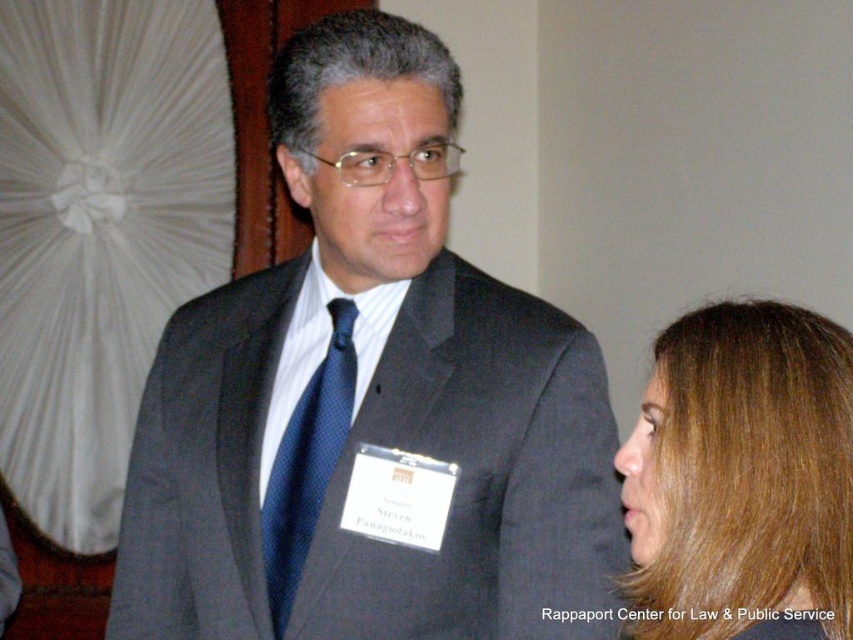
Question: Which point is farther from the camera taking this photo?

Choices:
 (A) (370, 598)
 (B) (802, 413)
 (C) (305, 540)

Answer: (C)

Question: Which object is the farthest from the brown hair at right?

Choices:
 (A) matte black suit at center
 (B) blue dotted tie at center

Answer: (B)

Question: In this image, where is matte black suit at center located relative to blue dotted tie at center?

Choices:
 (A) left
 (B) right

Answer: (B)

Question: Is brown hair at right below blue dotted tie at center?

Choices:
 (A) no
 (B) yes

Answer: (B)

Question: Which object is positioned closest to the brown hair at right?

Choices:
 (A) blue dotted tie at center
 (B) matte black suit at center

Answer: (B)

Question: Can you confirm if brown hair at right is smaller than blue dotted tie at center?

Choices:
 (A) yes
 (B) no

Answer: (B)